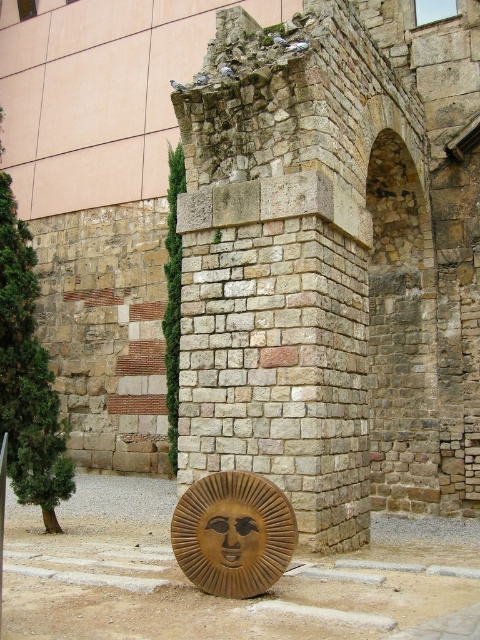
Is point (190, 515) positioned before point (261, 525)?

No.

Is the position of golden polished sun at lower center less distant than that of wooden carved face at lower center?

Yes, golden polished sun at lower center is closer to the viewer.

What do you see at coordinates (232, 532) in the screenshot? I see `golden polished sun at lower center` at bounding box center [232, 532].

The height and width of the screenshot is (640, 480). I want to click on golden polished sun at lower center, so click(232, 532).